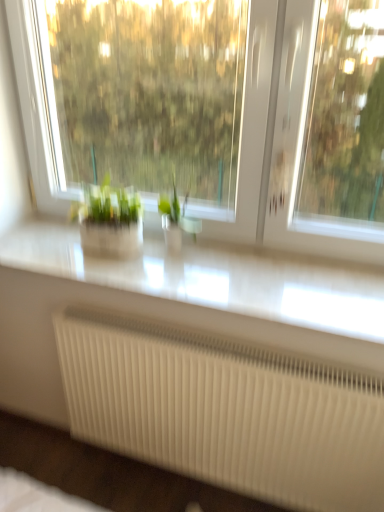
Locate an element on the screen. Image resolution: width=384 pixels, height=512 pixels. vacant space situated above white ribbed radiator at lower center (from a real-world perspective) is located at coordinates (241, 340).